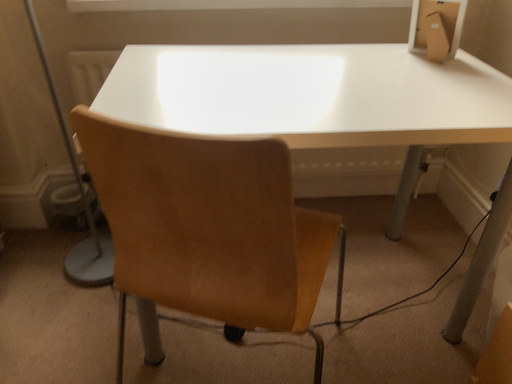
You are a GUI agent. You are given a task and a screenshot of the screen. Output one action in this format:
    pyautogui.click(x=<x>, y=<y>)
    Task: Click on the free space in front of brown cardboard box at upper right
    The image size is (512, 384).
    Given the screenshot: What is the action you would take?
    pyautogui.click(x=452, y=83)